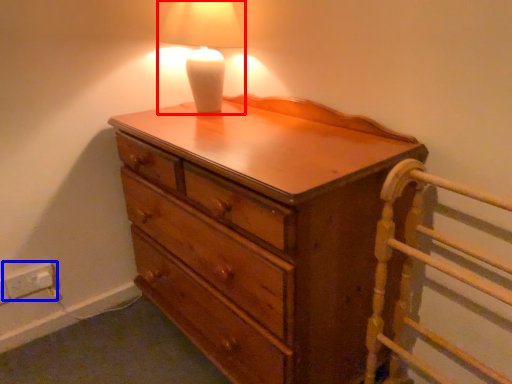
Question: Which point is closer to the camera, lamp (highlighted by a red box) or electric outlet (highlighted by a blue box)?

Choices:
 (A) lamp
 (B) electric outlet

Answer: (A)